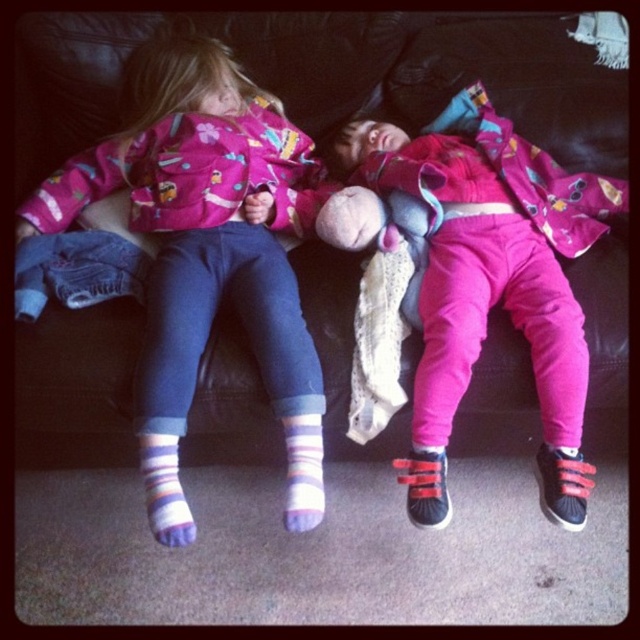
You are a photographer setting up a shoot in a living room. You need to place a large camera tripod in the center of the room. However, there is a black leather couch at center and pink velour pants at center in the way. Which object should you move to make space for the tripod?

The black leather couch at center is bigger than the pink velour pants at center, so you should move the pink velour pants at center to make space for the tripod since it is smaller and easier to relocate.